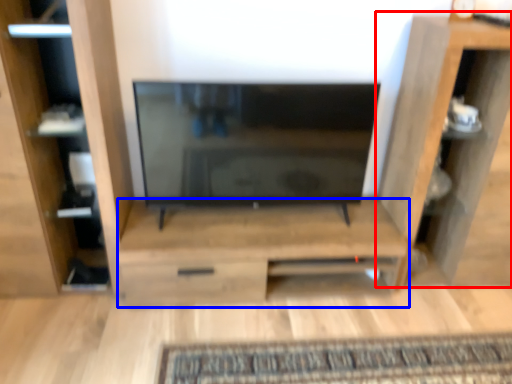
Question: Which object is closer to the camera taking this photo, shelf (highlighted by a red box) or cabinetry (highlighted by a blue box)?

Choices:
 (A) shelf
 (B) cabinetry

Answer: (A)